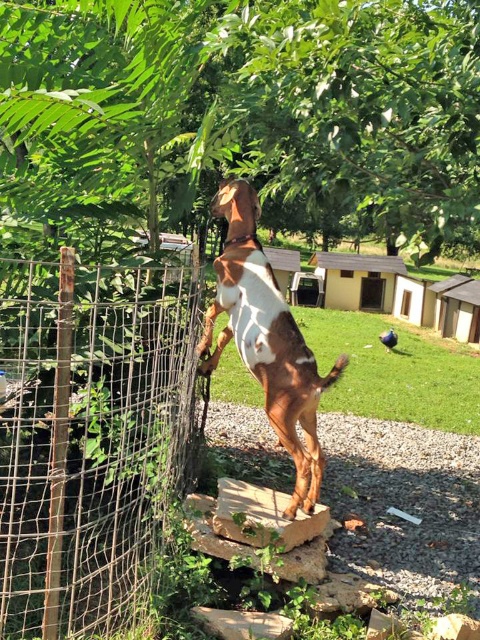
In the scene shown: You are standing in the backyard and want to reach the wire mesh fence at center without moving your feet. Can you touch it with your outstretched hand?

The wire mesh fence at center is 5.86 feet away from you, so you cannot reach it with your outstretched hand since the typical human arm length is about 3 feet.

You are a delivery person trying to deliver a package to the owner of the brown glossy dog at center. The package is too big to fit through the wire mesh fence at center. Can you determine if the package can be placed on top of the fence instead?

Result: The wire mesh fence at center is larger in size than brown glossy dog at center, so the fence is big enough to support the package placed on top of it.

Based on the photo, you are standing in the backyard and want to know where the wire mesh fence at center is located. Can you tell me its position using coordinates?

The wire mesh fence at center is located at coordinates point (88,436).